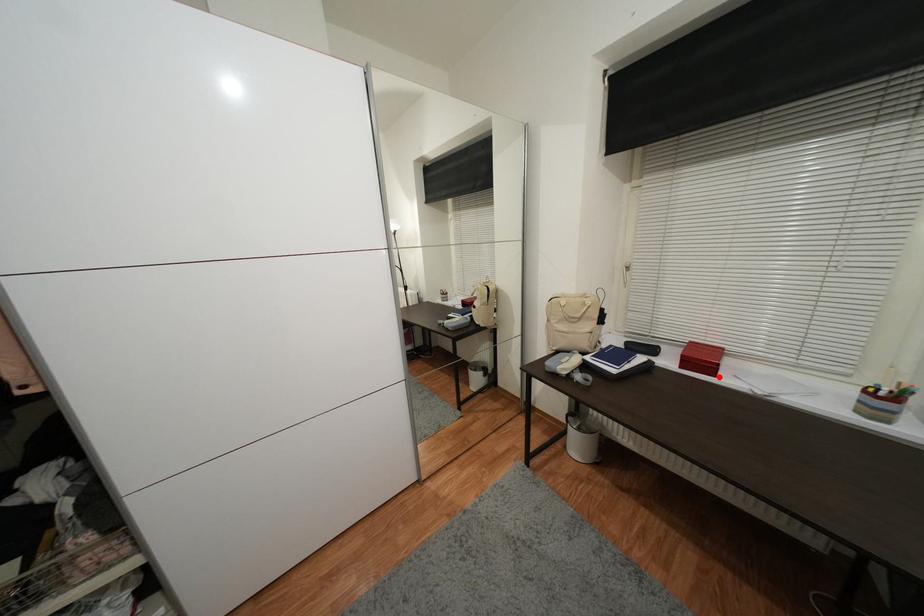
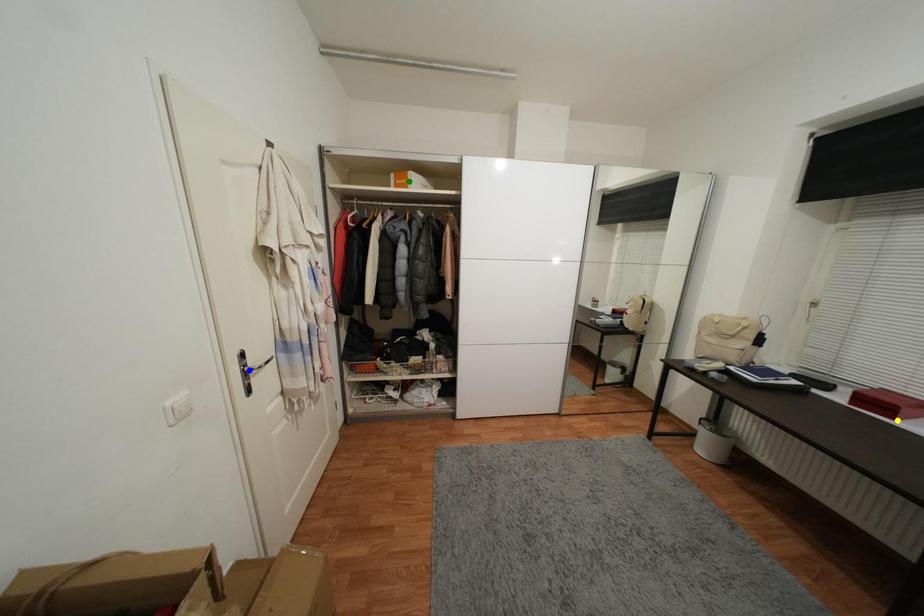
Question: I am providing you with two images of the same scene from different viewpoints. A red point is marked on the first image. You are given multiple points on the second image. Which spot in image 2 lines up with the point in image 1?

Choices:
 (A) green point
 (B) yellow point
 (C) blue point

Answer: (B)